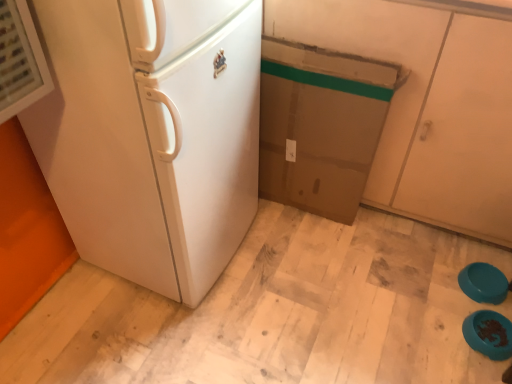
Locate an element on the screen. This screenshot has height=384, width=512. free space to the left of teal glossy bowls at lower right, the 2th appliance in the back-to-front sequence is located at coordinates (437, 329).